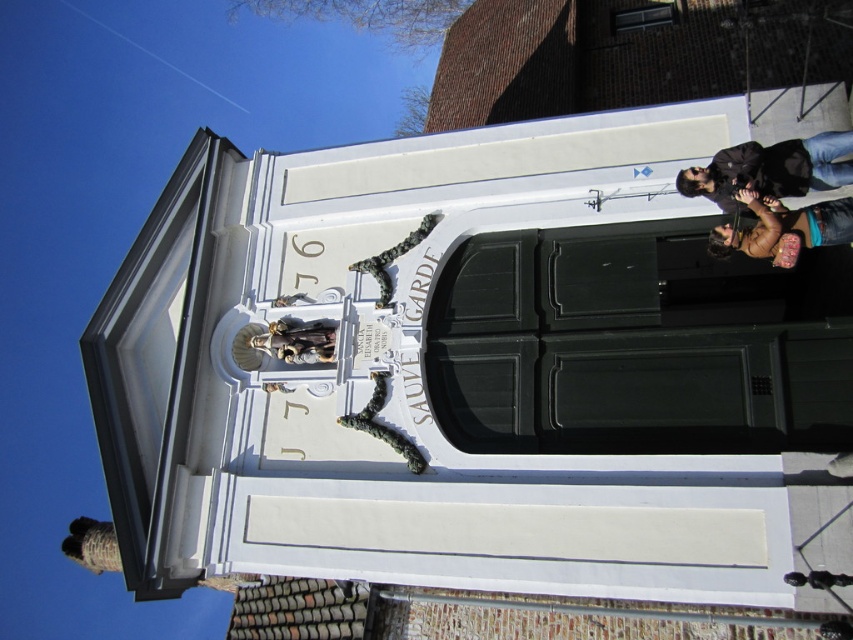
Question: Which object appears farthest from the camera in this image?

Choices:
 (A) brown leather jacket at upper right
 (B) black leather jacket at upper right

Answer: (B)

Question: Can you confirm if black leather jacket at upper right is bigger than brown leather jacket at upper right?

Choices:
 (A) no
 (B) yes

Answer: (A)

Question: Does black leather jacket at upper right have a lesser width compared to brown leather jacket at upper right?

Choices:
 (A) no
 (B) yes

Answer: (A)

Question: Which point is farther to the camera?

Choices:
 (A) (717, 228)
 (B) (735, 211)

Answer: (B)

Question: Does black leather jacket at upper right appear under brown leather jacket at upper right?

Choices:
 (A) yes
 (B) no

Answer: (B)